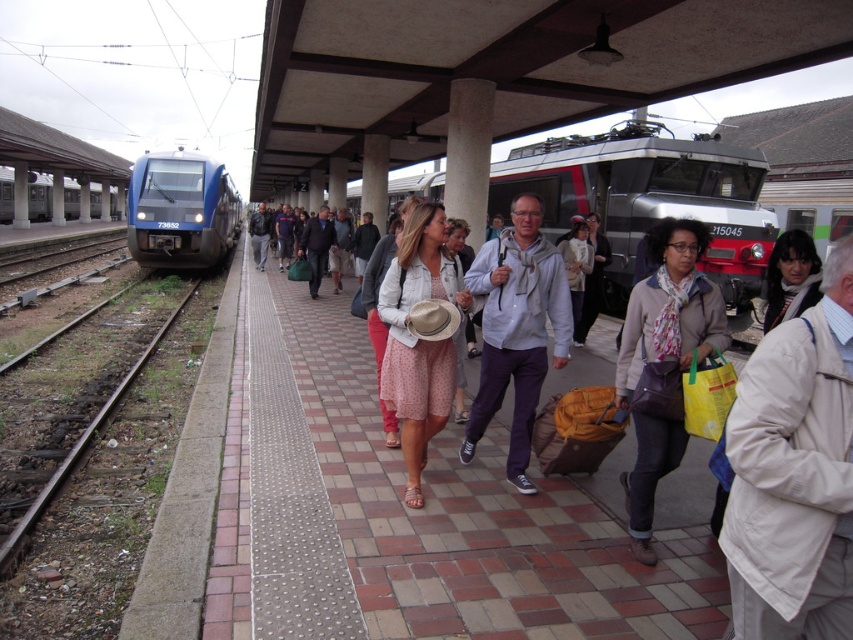
You are standing on the platform at the train station. You see a point marked at coordinate [648,198]. What object is located at that point?

The point at coordinate [648,198] indicates a silver metallic train at center.

You are a photographer standing on the train station platform. You want to take a photo of the white cotton coat at center from a distance that ensures it fills the frame without being too close. Considering the camera you have can focus clearly up to 2 meters, will you need to adjust your position to maintain clarity?

The white cotton coat at center is 1.83 meters away from the camera, which is within the 2 meter focus range. Therefore, you do not need to adjust your position to maintain clarity.

You are a passenger standing at the platform edge near the brown gravel train track at left. You see the light gray hoodie at center walking towards you. If you want to avoid collision, should you step to the right or left side of the platform?

The light gray hoodie at center and brown gravel train track at left are 3.51 meters apart from each other. Since the hoodie is approaching from 3.51 meters away, stepping to the right side of the platform would allow enough space to avoid collision.